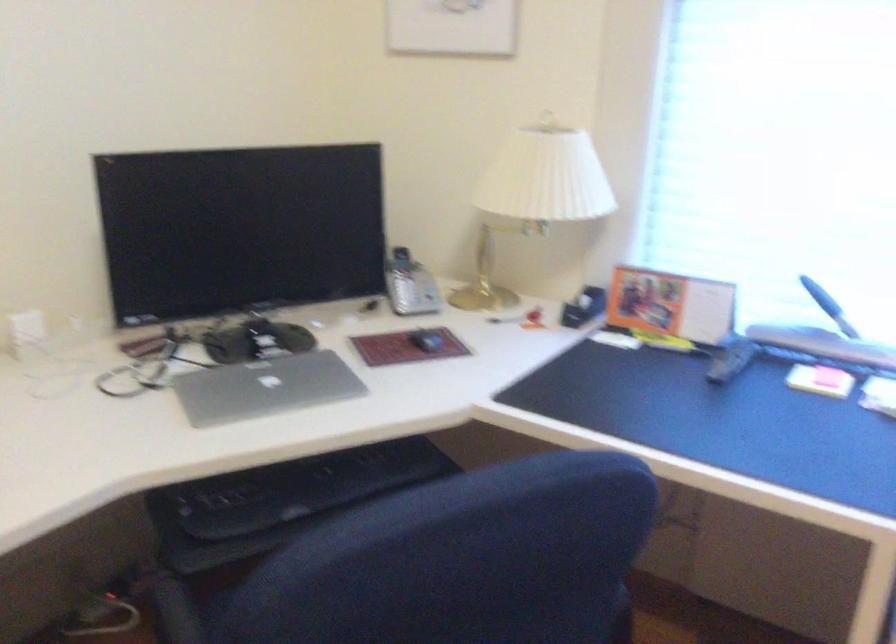
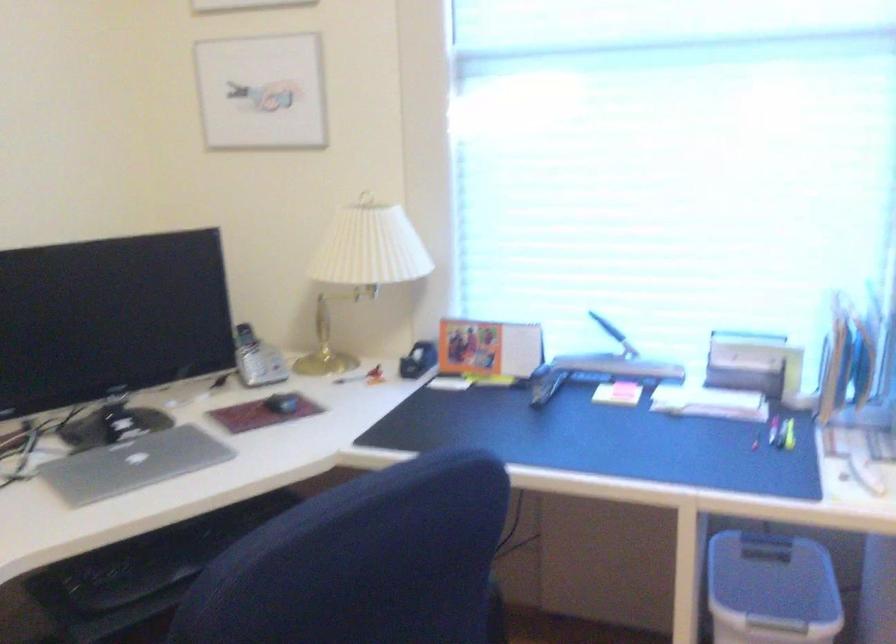
Locate, in the second image, the point that corresponds to point (410, 287) in the first image.

(256, 359)